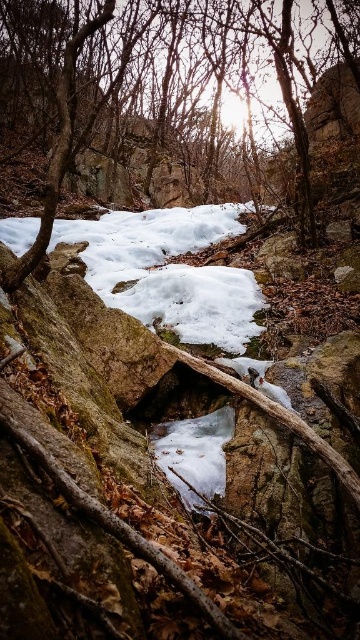
Question: Which of the following is the farthest from the observer?

Choices:
 (A) white frosty snow at center
 (B) brown wood tree at center

Answer: (A)

Question: Among these objects, which one is nearest to the camera?

Choices:
 (A) brown wood tree at center
 (B) white frosty snow at center

Answer: (A)

Question: Is brown wood tree at center smaller than white frosty snow at center?

Choices:
 (A) yes
 (B) no

Answer: (B)

Question: Is the position of brown wood tree at center less distant than that of white frosty snow at center?

Choices:
 (A) yes
 (B) no

Answer: (A)

Question: Is brown wood tree at center above white frosty snow at center?

Choices:
 (A) yes
 (B) no

Answer: (A)